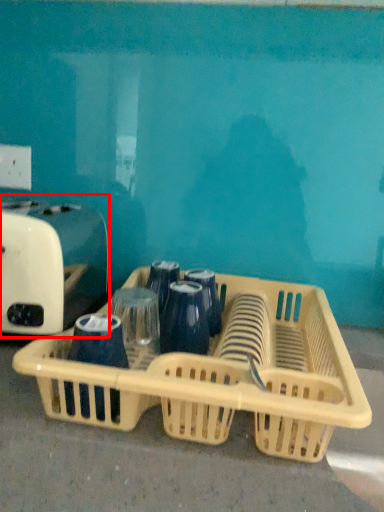
Question: In this image, where is toaster (annotated by the red box) located relative to basket?

Choices:
 (A) right
 (B) left

Answer: (B)